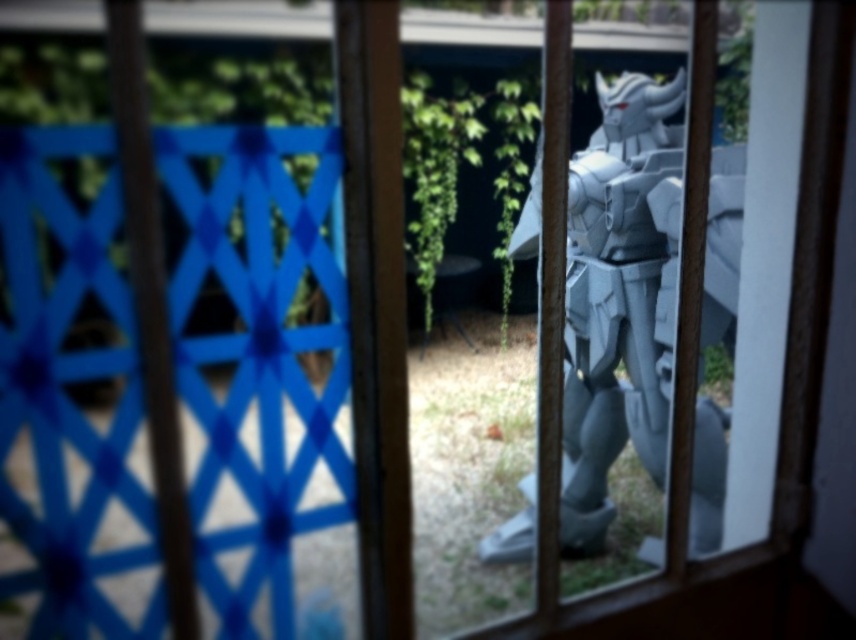
Between blue lattice fence at left and gray metallic armor at center, which one has more height?

With more height is blue lattice fence at left.

From the picture: Measure the distance between blue lattice fence at left and camera.

They are 4.33 feet apart.

Locate an element on the screen. The image size is (856, 640). blue lattice fence at left is located at coordinates (256, 348).

Image resolution: width=856 pixels, height=640 pixels. I want to click on blue lattice fence at left, so click(256, 348).